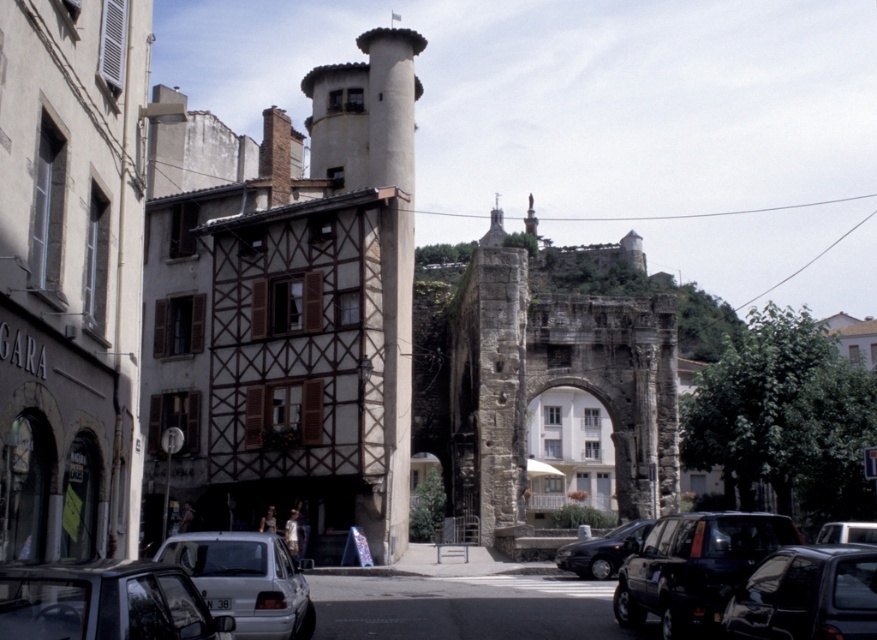
You are standing at the origin point in the image and looking towards the large stone archway. Which of the two points, point [617,552] or point [875,524], is closer to you?

Point [875,524] is closer to you because it is in front of point [617,552].

You are a delivery person trying to park your delivery van, which is 1.8 meters tall, in this area. Based on the scene, can you safely park your van between the metallic gray car at lower right and the metallic silver car at center without hitting the roof?

The metallic gray car at lower right is not as tall as metallic silver car at center. Since the delivery van is 1.8 meters tall, you need to compare with the taller car. If the metallic silver car at center is taller than 1.8 meters, the van cannot park there. If it is shorter, it can. However, the exact height of the silver car isn

You are standing at the base of the large stone archway and want to walk to the point marked as point (x=127, y=628). Will you pass by point (x=854, y=532) on your way?

Yes, because point (x=127, y=628) is in front of point (x=854, y=532), so you will pass by point (x=854, y=532) on your way to point (x=127, y=628).